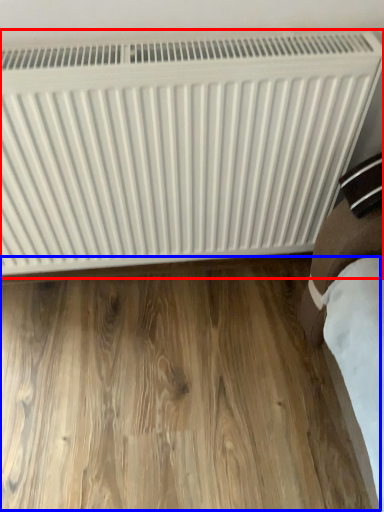
Question: Which of the following is the closest to the observer, radiator (highlighted by a red box) or hardwood (highlighted by a blue box)?

Choices:
 (A) radiator
 (B) hardwood

Answer: (A)